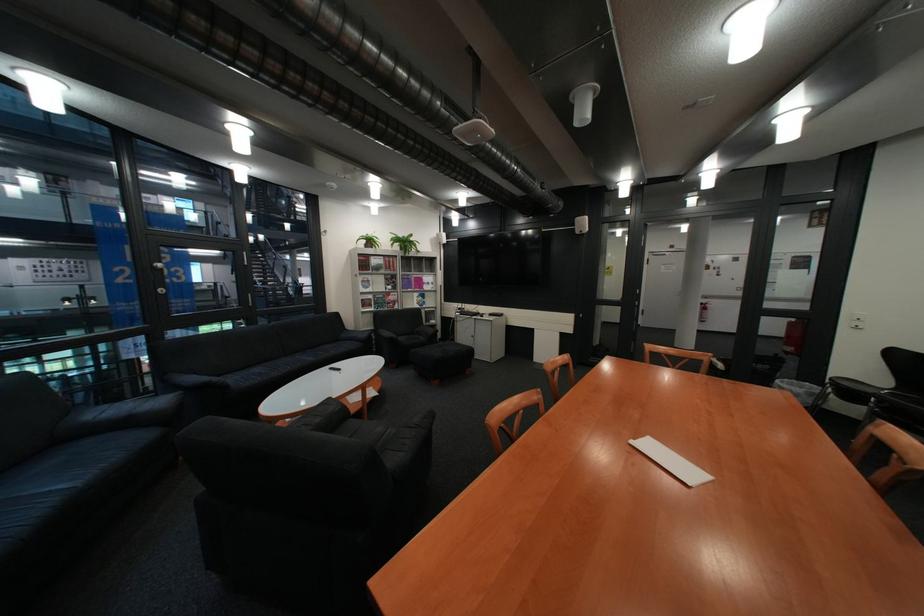
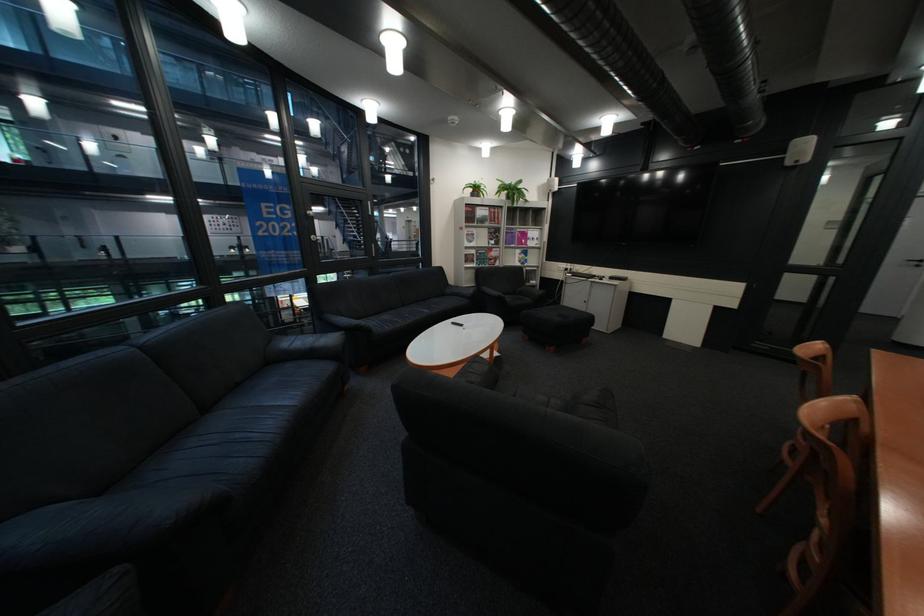
Question: In a continuous first-person perspective shot, in which direction is the camera moving?

Choices:
 (A) Left
 (B) Right
 (C) Forward
 (D) Backward

Answer: (A)